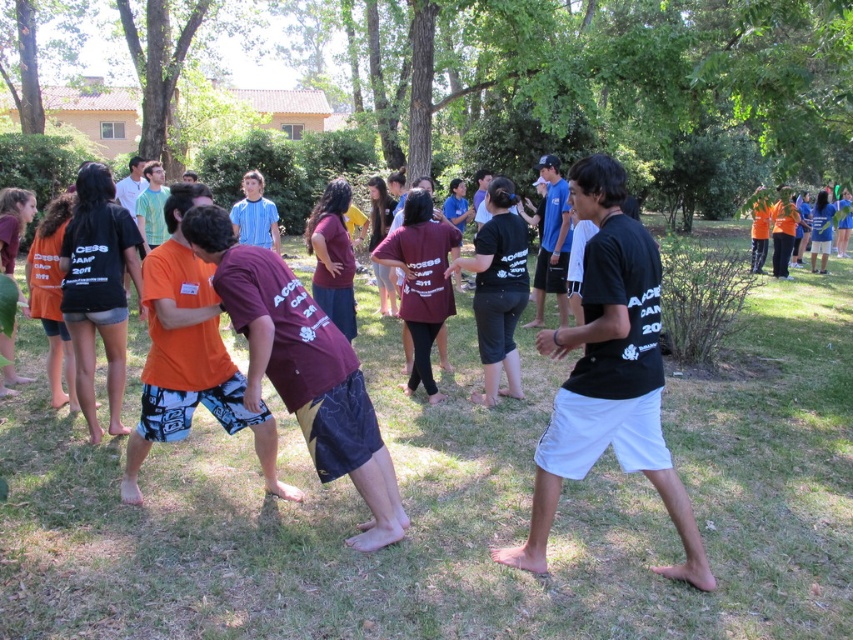
Question: Where is green grass at center located in relation to black matte shirt at center in the image?

Choices:
 (A) left
 (B) right

Answer: (B)

Question: Considering the real-world distances, which object is closest to the green grass at center?

Choices:
 (A) black matte shirt at center
 (B) orange t-shirt at upper right

Answer: (A)

Question: Which point is farther to the camera?

Choices:
 (A) black matte shirt at center
 (B) green grass at center
 (C) orange t-shirt at upper right

Answer: (C)

Question: Which is nearer to the green grass at center?

Choices:
 (A) black matte shirt at center
 (B) orange t-shirt at upper right

Answer: (A)

Question: Is the position of green grass at center more distant than that of black matte shirt at center?

Choices:
 (A) no
 (B) yes

Answer: (A)

Question: Does green grass at center have a greater width compared to orange t-shirt at upper right?

Choices:
 (A) yes
 (B) no

Answer: (A)